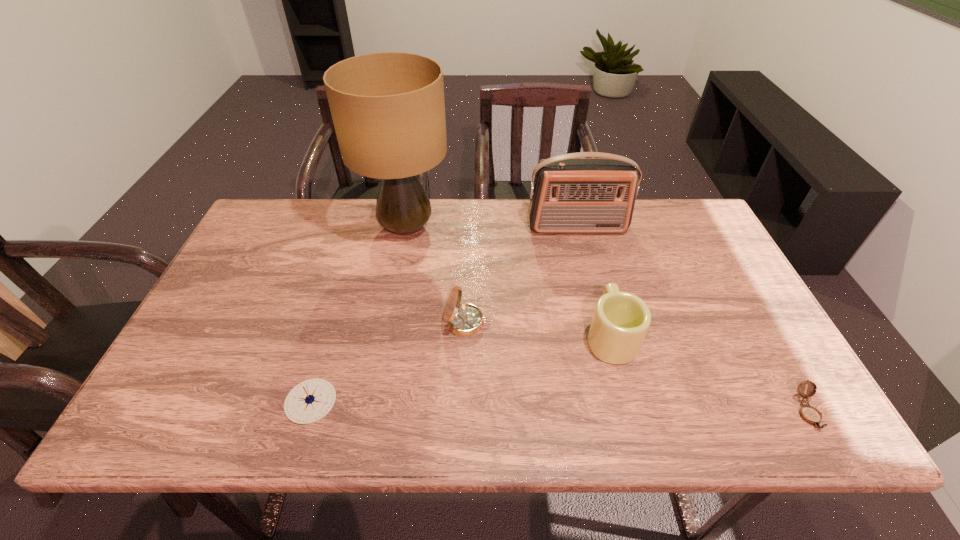
In the image, there is a desktop. At what (x,y) coordinates should I click in order to perform the action: click on vacant space at the left edge. Please return your answer as a coordinate pair (x, y). Looking at the image, I should click on (214, 376).

Where is `vacant area between the rightmost compass and the mug`? The width and height of the screenshot is (960, 540). vacant area between the rightmost compass and the mug is located at coordinates (708, 374).

Find the location of a particular element. The image size is (960, 540). vacant area that lies between the rightmost object and the second tallest object is located at coordinates (692, 320).

Identify the location of vacant area that lies between the second tallest object and the leftmost compass. This screenshot has width=960, height=540. (444, 314).

The height and width of the screenshot is (540, 960). In order to click on free space between the farthest compass and the radio receiver in this screenshot , I will do `click(522, 275)`.

At what (x,y) coordinates should I click in order to perform the action: click on free spot between the mug and the rightmost compass. Please return your answer as a coordinate pair (x, y). Image resolution: width=960 pixels, height=540 pixels. Looking at the image, I should click on (708, 374).

You are a GUI agent. You are given a task and a screenshot of the screen. Output one action in this format:
    pyautogui.click(x=<x>, y=<y>)
    Task: Click on the free point between the rightmost object and the second compass from right to left
    The height and width of the screenshot is (540, 960).
    Given the screenshot: What is the action you would take?
    pyautogui.click(x=637, y=368)

You are a GUI agent. You are given a task and a screenshot of the screen. Output one action in this format:
    pyautogui.click(x=<x>, y=<y>)
    Task: Click on the blank region between the radio receiver and the tallest object
    
    Given the screenshot: What is the action you would take?
    pyautogui.click(x=492, y=227)

Identify the location of free space between the tallest compass and the radio receiver. (522, 275).

I want to click on free area in between the leftmost compass and the radio receiver, so click(x=444, y=314).